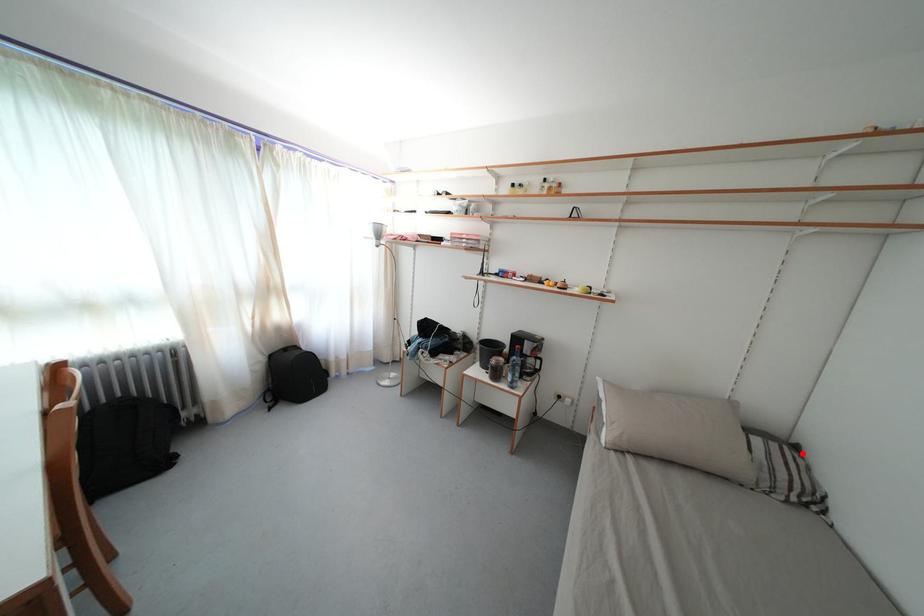
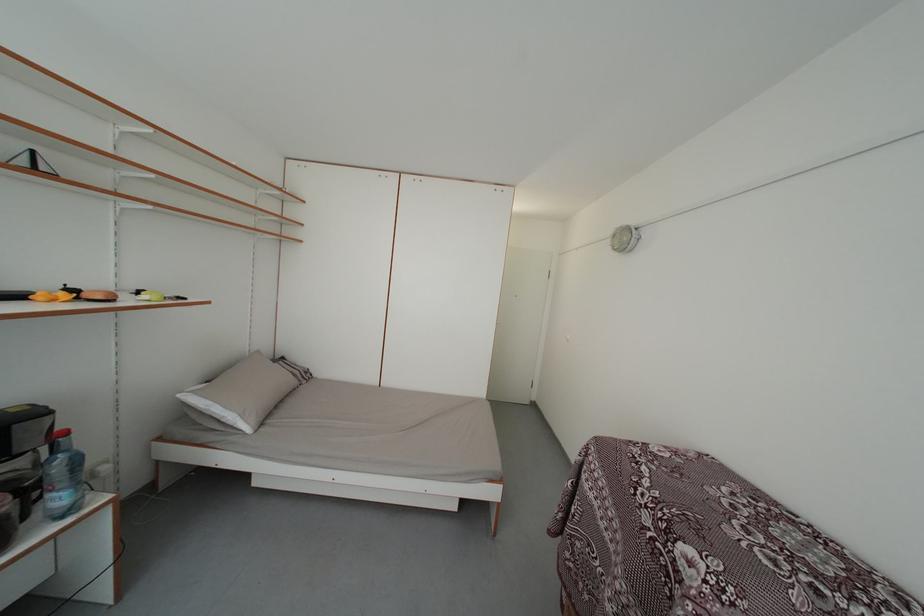
Find the pixel in the second image that matches the highlighted location in the first image.

(289, 365)